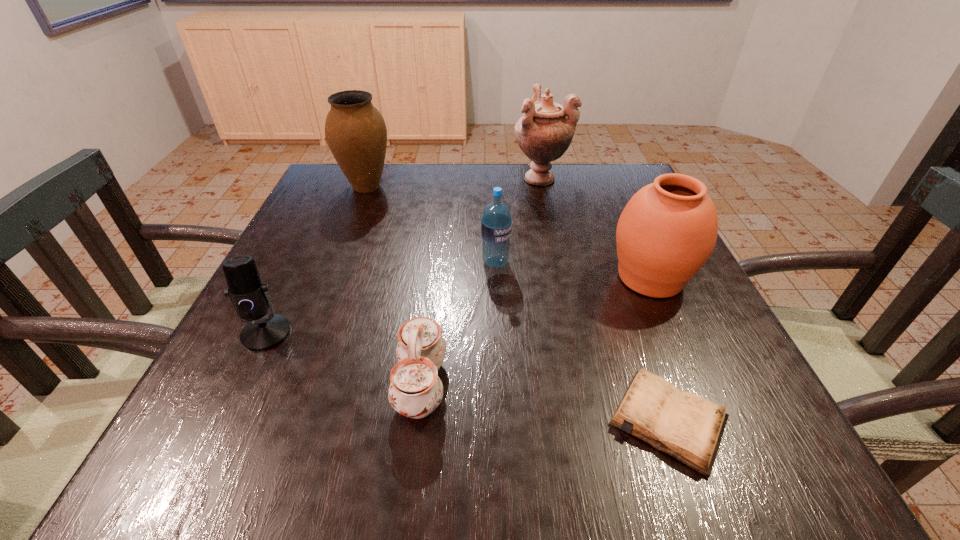
Locate an element on the screen. urn that can be found as the second closest to the second urn from left to right is located at coordinates (356, 133).

Identify which urn is located as the second nearest to the leftmost urn. Please provide its 2D coordinates. Your answer should be formatted as a tuple, i.e. [(x, y)], where the tuple contains the x and y coordinates of a point satisfying the conditions above.

[(667, 231)]

Where is `vacant space that satisfies the following two spatial constraints: 1. on the front side of the water bottle; 2. on the right side of the shortest object`? vacant space that satisfies the following two spatial constraints: 1. on the front side of the water bottle; 2. on the right side of the shortest object is located at coordinates (502, 421).

Image resolution: width=960 pixels, height=540 pixels. In order to click on free space that satisfies the following two spatial constraints: 1. by the handle of the chinaware; 2. on the left side of the diary in this screenshot , I will do [x=417, y=421].